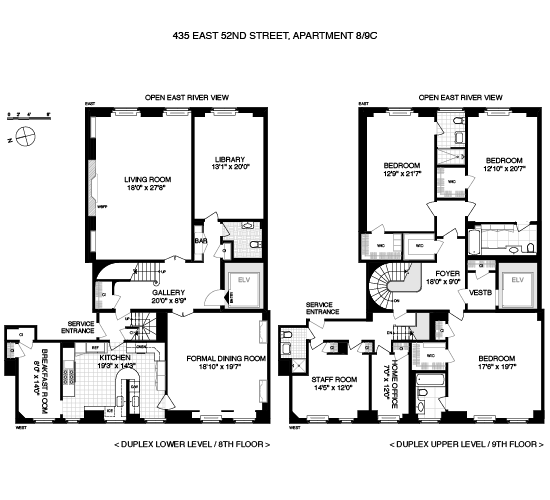
This screenshot has width=550, height=500. In order to click on floor plan in this screenshot , I will do `click(191, 281)`, `click(432, 287)`.